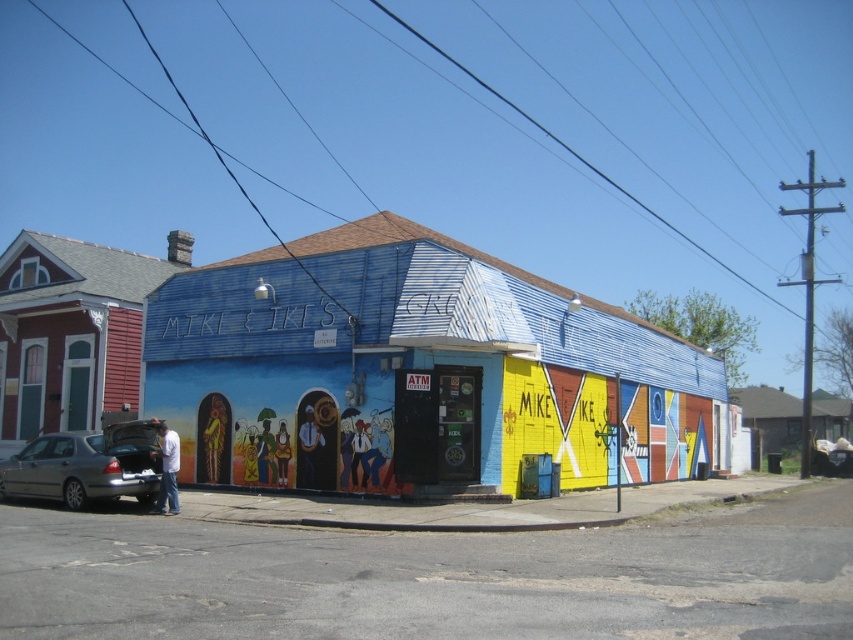
You are standing in front of the building with the colorful mural. There is a specific point marked at coordinates (415, 371). Which building does this point belong to?

The point at coordinates (415, 371) corresponds to the blue painted building at center.

What is the color of the building located at the coordinates point (x=415, y=371)?

The blue painted building at center is marked by point (x=415, y=371), so the building at those coordinates is blue.

You are a delivery driver who needs to park your silver sedan in front of the blue building. Based on the scene, can your metallic gray sedan at lower left fit directly in front of the blue painted building at center without blocking the entrance?

The blue painted building at center is above metallic gray sedan at lower left, which means the sedan is positioned lower down relative to the building. Since the sedan is already at the lower left and the building is above it, there might not be enough space in front of the building for the sedan to park without blocking the entrance. However, the exact positioning isn not fully clear from the description alone.